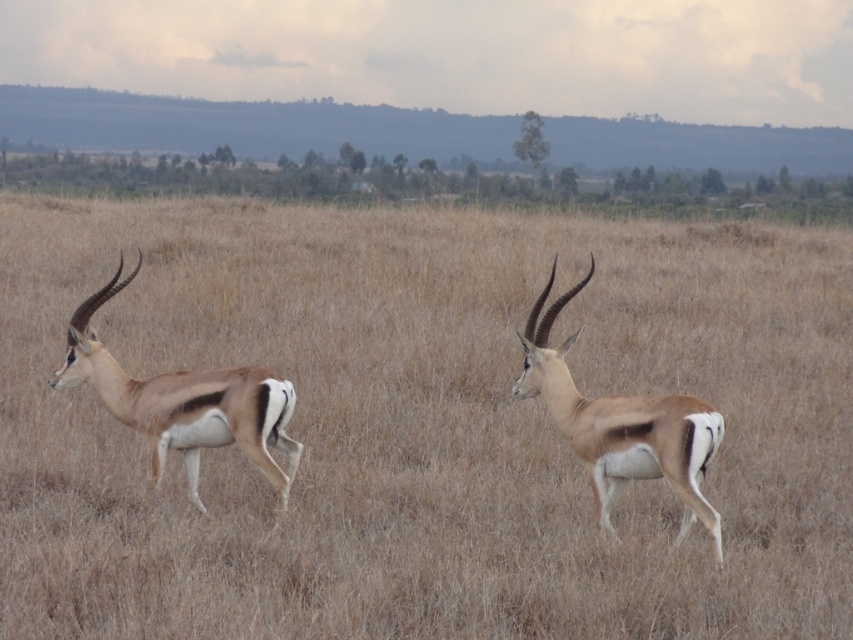
Measure the distance between point [589,365] and camera.

Point [589,365] and camera are 9.17 meters apart.

Can you confirm if brown dry grass at center is taller than brown smooth antelope at left?

Indeed, brown dry grass at center has a greater height compared to brown smooth antelope at left.

Image resolution: width=853 pixels, height=640 pixels. Find the location of `brown dry grass at center`. brown dry grass at center is located at coordinates click(422, 426).

Find the location of a particular element. The image size is (853, 640). brown dry grass at center is located at coordinates (422, 426).

Between brown dry grass at center and brown matte deer at center, which one is positioned higher?

brown dry grass at center

Does point (122, 332) come farther from viewer compared to point (577, 445)?

That is True.

The height and width of the screenshot is (640, 853). What are the coordinates of `brown dry grass at center` in the screenshot? It's located at (422, 426).

Is brown smooth antelope at left smaller than brown matte deer at center?

No.

Can you confirm if brown smooth antelope at left is positioned below brown matte deer at center?

Incorrect, brown smooth antelope at left is not positioned below brown matte deer at center.

This screenshot has height=640, width=853. Identify the location of brown smooth antelope at left. (184, 403).